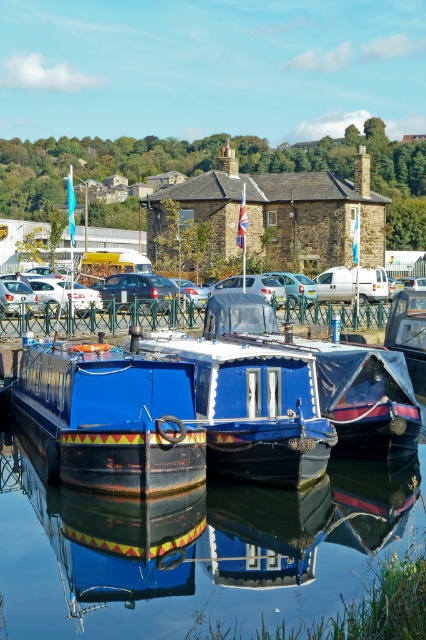
Question: Is smooth dark blue water at center in front of shiny blue boat at center?

Choices:
 (A) no
 (B) yes

Answer: (B)

Question: Which object appears farthest from the camera in this image?

Choices:
 (A) shiny blue boat at center
 (B) smooth dark blue water at center

Answer: (A)

Question: Which of the following is the farthest from the observer?

Choices:
 (A) shiny blue boat at center
 (B) smooth dark blue water at center

Answer: (A)

Question: Does smooth dark blue water at center have a greater width compared to shiny blue boat at center?

Choices:
 (A) no
 (B) yes

Answer: (A)

Question: Is smooth dark blue water at center closer to camera compared to shiny blue boat at center?

Choices:
 (A) yes
 (B) no

Answer: (A)

Question: Which point is farther to the camera?

Choices:
 (A) shiny blue boat at center
 (B) smooth dark blue water at center

Answer: (A)